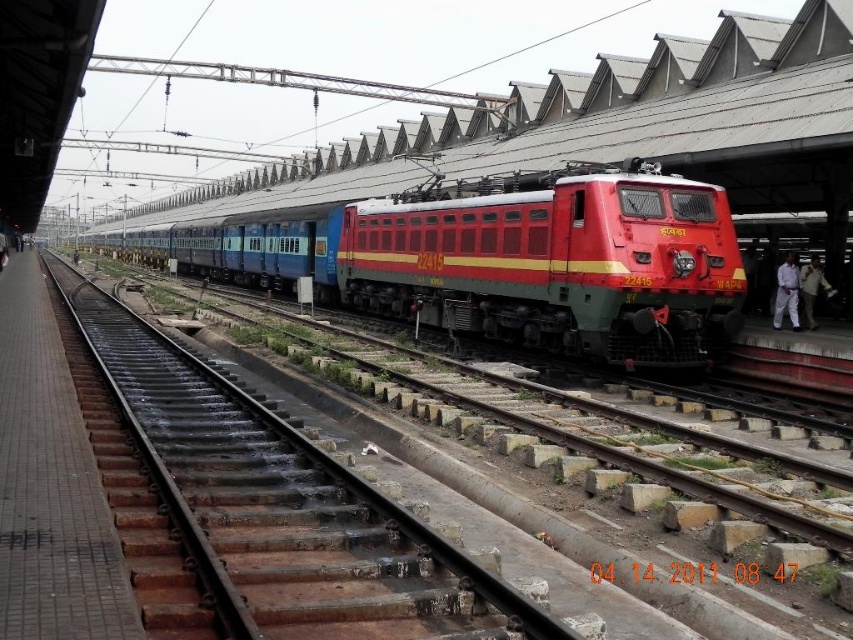
Question: Which point is closer to the camera?

Choices:
 (A) shiny red locomotive at center
 (B) metal train track at center

Answer: (B)

Question: Is shiny red locomotive at center above metal train track at center?

Choices:
 (A) no
 (B) yes

Answer: (B)

Question: Can you confirm if shiny red locomotive at center is positioned to the right of metal train track at center?

Choices:
 (A) no
 (B) yes

Answer: (B)

Question: Can you confirm if shiny red locomotive at center is positioned below metal train track at center?

Choices:
 (A) no
 (B) yes

Answer: (A)